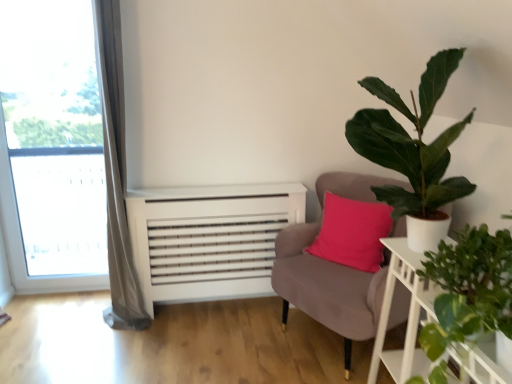
Question: Considering the relative sizes of transparent glass window at left and green leafy plant at right, arranged as the 1th houseplant when ordered from the bottom, in the image provided, is transparent glass window at left taller than green leafy plant at right, arranged as the 1th houseplant when ordered from the bottom,?

Choices:
 (A) no
 (B) yes

Answer: (B)

Question: From the image's perspective, is transparent glass window at left located beneath green leafy plant at right, arranged as the 1th houseplant when ordered from the bottom?

Choices:
 (A) yes
 (B) no

Answer: (B)

Question: Is the position of transparent glass window at left less distant than that of green leafy plant at right, positioned as the 2th houseplant in top-to-bottom order?

Choices:
 (A) no
 (B) yes

Answer: (A)

Question: Is transparent glass window at left not near green leafy plant at right, arranged as the 1th houseplant when ordered from the bottom?

Choices:
 (A) no
 (B) yes

Answer: (B)

Question: From the image's perspective, would you say transparent glass window at left is positioned over green leafy plant at right, positioned as the 2th houseplant in top-to-bottom order?

Choices:
 (A) yes
 (B) no

Answer: (A)

Question: Considering the relative positions of transparent glass window at left and white wooden table at right in the image provided, is transparent glass window at left to the left or to the right of white wooden table at right?

Choices:
 (A) left
 (B) right

Answer: (A)

Question: Is point (72, 13) positioned closer to the camera than point (387, 286)?

Choices:
 (A) closer
 (B) farther

Answer: (B)

Question: From the image's perspective, is transparent glass window at left above or below white wooden table at right?

Choices:
 (A) above
 (B) below

Answer: (A)

Question: Which is correct: transparent glass window at left is inside white wooden table at right, or outside of it?

Choices:
 (A) outside
 (B) inside

Answer: (A)

Question: Considering the positions of velvet pink chair at center and transparent glass window at left in the image, is velvet pink chair at center taller or shorter than transparent glass window at left?

Choices:
 (A) short
 (B) tall

Answer: (A)

Question: Is velvet pink chair at center bigger or smaller than transparent glass window at left?

Choices:
 (A) big
 (B) small

Answer: (A)

Question: Is velvet pink chair at center inside or outside of transparent glass window at left?

Choices:
 (A) inside
 (B) outside

Answer: (B)

Question: From a real-world perspective, relative to transparent glass window at left, is velvet pink chair at center vertically above or below?

Choices:
 (A) above
 (B) below

Answer: (B)

Question: Considering their positions, is green matte plant at upper right, which appears as the 2th houseplant when ordered from the bottom, located in front of or behind white wooden table at right?

Choices:
 (A) front
 (B) behind

Answer: (A)

Question: From a real-world perspective, is green matte plant at upper right, which appears as the 1th houseplant when viewed from the top, physically located above or below white wooden table at right?

Choices:
 (A) above
 (B) below

Answer: (A)